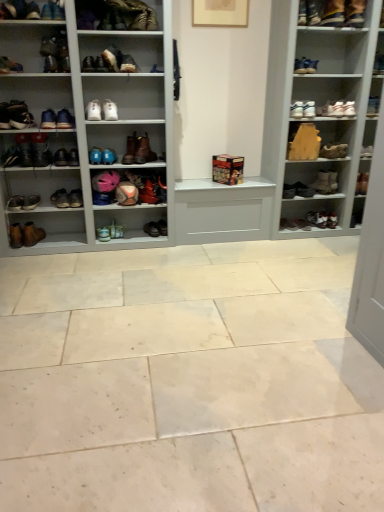
Locate an element on the screen. vacant area to the left of brown leather shoe at center, placed as the twentieth shoe when sorted from left to right is located at coordinates (139, 236).